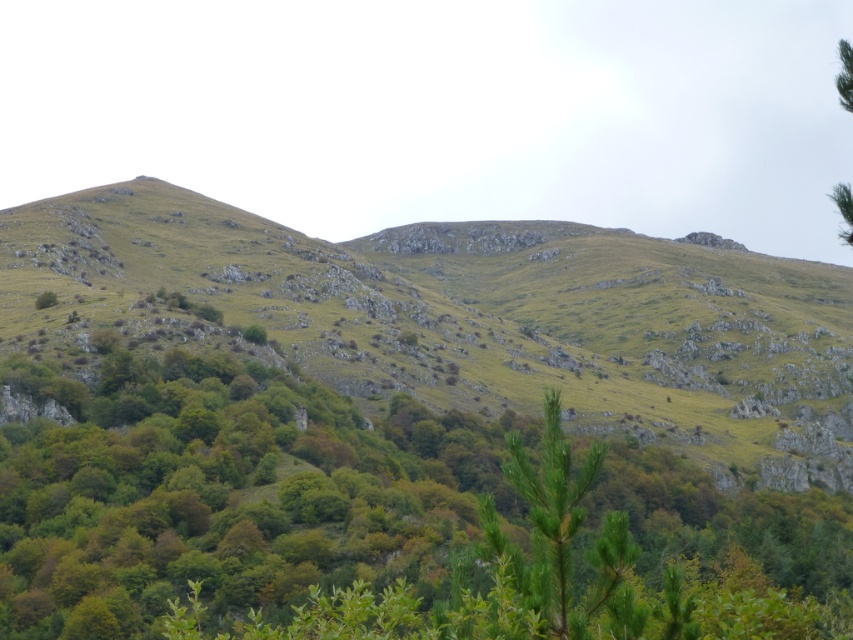
You are standing at the origin point in the image and want to reach the green grassy hill at center. According to the coordinates provided, in which direction should you move to get there?

The green grassy hill at center is located at point (463, 317), which is slightly to the right and above your current position at the origin. Move northeast to reach it.

You are a hiker trying to decide whether to climb the green grassy hill at center or the green leafy tree at center. Which one is taller?

The green grassy hill at center is taller than the green leafy tree at center, so you should choose the green grassy hill at center if you want to climb the taller one.

You are a hiker standing on the green grassy hill at center and want to reach the green leafy tree at upper right. Which direction should you move to get closer to the tree?

You should move forward because the green leafy tree at upper right is further away from you than the green grassy hill at center, so moving forward towards it will get you closer.